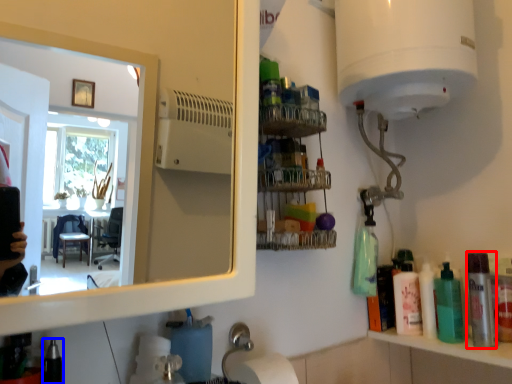
Question: Which point is closer to the camera, mouthwash (highlighted by a red box) or toiletry (highlighted by a blue box)?

Choices:
 (A) mouthwash
 (B) toiletry

Answer: (B)